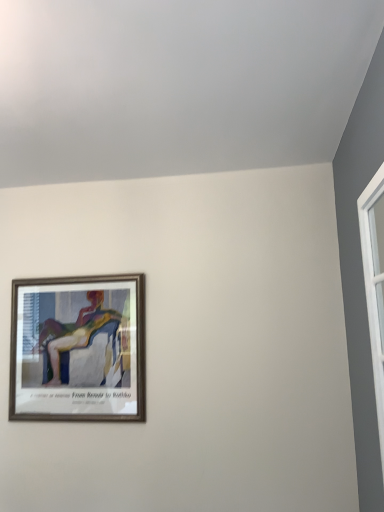
The height and width of the screenshot is (512, 384). What are the coordinates of `brown wooden picture frame at upper left` in the screenshot? It's located at (78, 349).

This screenshot has width=384, height=512. What do you see at coordinates (78, 349) in the screenshot?
I see `brown wooden picture frame at upper left` at bounding box center [78, 349].

At what (x,y) coordinates should I click in order to perform the action: click on brown wooden picture frame at upper left. Please return your answer as a coordinate pair (x, y). The image size is (384, 512). Looking at the image, I should click on (x=78, y=349).